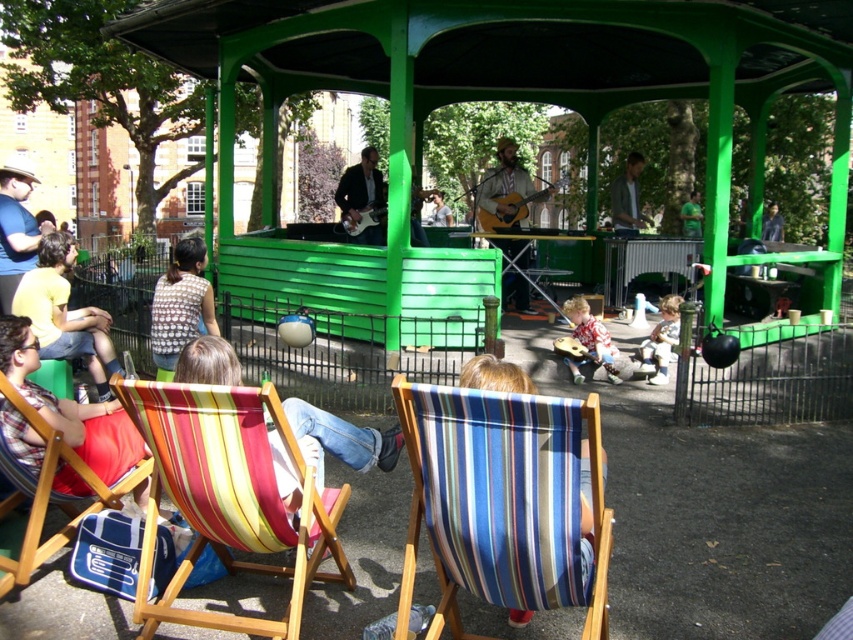
You are organizing a small outdoor event and need to seat two guests in the area near the band. You have two striped fabric chairs available. One is labeled as the striped fabric beach chair at lower left and the other is the striped fabric chair at lower left. Which chair should you choose if you want to accommodate a guest who prefers more seating space?

The striped fabric beach chair at lower left is larger in size than the striped fabric chair at lower left, so you should choose the striped fabric beach chair at lower left to accommodate the guest who prefers more seating space.

You are standing at point (x=660, y=344) and want to walk to the bandstand. There is a point (x=15, y=216) that you can see. Is this point in front of or behind your current position relative to the direction you are facing?

Point (x=15, y=216) is in front of point (x=660, y=344), so it is in front of your current position.